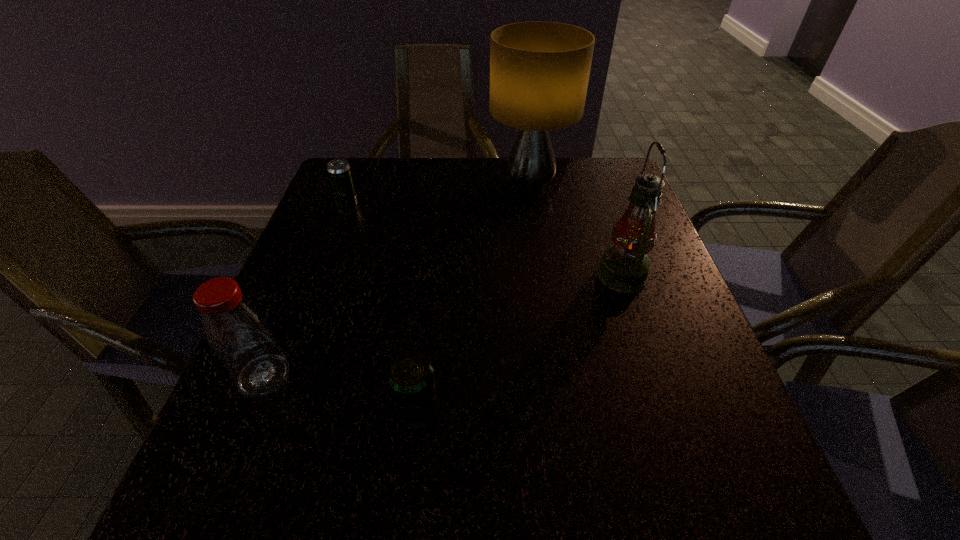
You are a GUI agent. You are given a task and a screenshot of the screen. Output one action in this format:
    pyautogui.click(x=<x>, y=<y>)
    Task: Click on the free space that satisfies the following two spatial constraints: 1. on the front side of the shorter beer can; 2. on the left side of the left beer can
    
    Given the screenshot: What is the action you would take?
    pyautogui.click(x=274, y=406)

Locate an element on the screen. free region that satisfies the following two spatial constraints: 1. on the back side of the third tallest object; 2. on the left side of the lampshade is located at coordinates (343, 186).